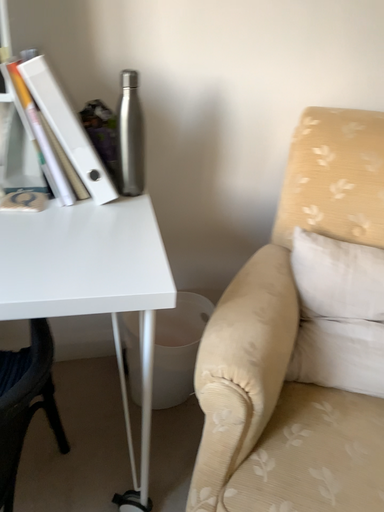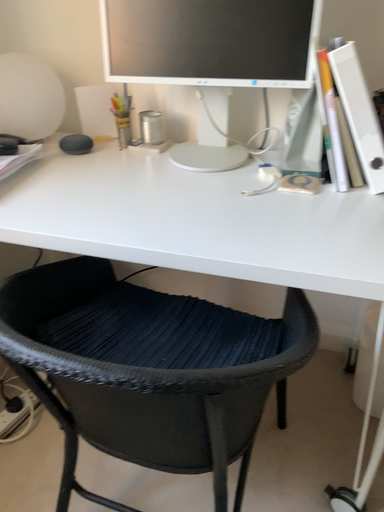
Question: How did the camera likely rotate when shooting the video?

Choices:
 (A) rotated left
 (B) rotated right

Answer: (A)